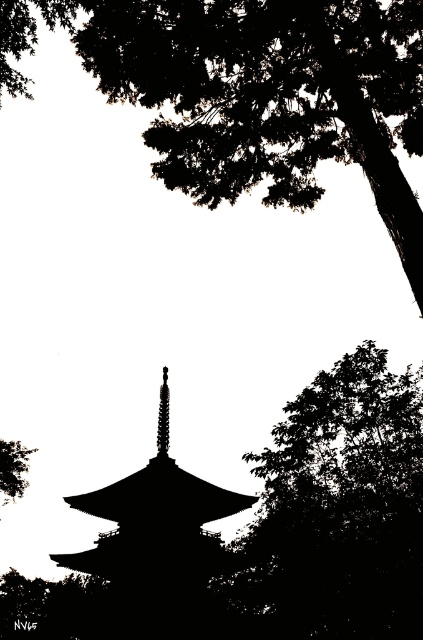
You are standing in front of a traditional pagoda surrounded by trees. You notice a point marked at coordinates (156, 547). What does this point represent?

The point at coordinates (156, 547) represents the black matte tower at center.

You are an architect analyzing the composition of the image. The pagoda is the central focus. Where is the silhouette leafy tree at right located in terms of its 2D coordinates?

The silhouette leafy tree at right is located at the 2D coordinates point (340, 508).

From the picture: You are standing in front of the pagoda and want to place a small offering at the base of the black matte tower at center. To do this, you need to walk around the smooth silver spire at center. Which direction should you move relative to the spire to reach the tower?

The black matte tower at center is to the left of the smooth silver spire at center, so you should move to the left side of the spire to reach the tower.